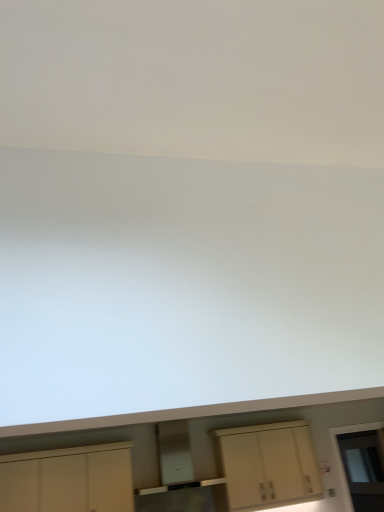
Question: Is white matte cabinet at lower left, which ranks as the 1th cabinetry in left-to-right order, closer to camera compared to transparent glass door at lower right?

Choices:
 (A) yes
 (B) no

Answer: (A)

Question: Is white matte cabinet at lower left, acting as the second cabinetry starting from the right, looking in the opposite direction of transparent glass door at lower right?

Choices:
 (A) no
 (B) yes

Answer: (A)

Question: Does white matte cabinet at lower left, acting as the second cabinetry starting from the right, have a lesser width compared to transparent glass door at lower right?

Choices:
 (A) no
 (B) yes

Answer: (A)

Question: Could you tell me if white matte cabinet at lower left, which ranks as the 1th cabinetry in left-to-right order, is facing transparent glass door at lower right?

Choices:
 (A) no
 (B) yes

Answer: (A)

Question: Is transparent glass door at lower right inside white matte cabinet at lower left, acting as the second cabinetry starting from the right?

Choices:
 (A) yes
 (B) no

Answer: (B)

Question: Can you confirm if white matte cabinet at lower left, which ranks as the 1th cabinetry in left-to-right order, is bigger than transparent glass door at lower right?

Choices:
 (A) yes
 (B) no

Answer: (A)

Question: Is transparent glass door at lower right bigger than matte cream cabinet at center, which is counted as the first cabinetry, starting from the right?

Choices:
 (A) yes
 (B) no

Answer: (B)

Question: Considering the relative sizes of transparent glass door at lower right and matte cream cabinet at center, which is counted as the first cabinetry, starting from the right, in the image provided, is transparent glass door at lower right thinner than matte cream cabinet at center, which is counted as the first cabinetry, starting from the right,?

Choices:
 (A) yes
 (B) no

Answer: (A)

Question: From the image's perspective, is transparent glass door at lower right located beneath matte cream cabinet at center, which is counted as the first cabinetry, starting from the right?

Choices:
 (A) no
 (B) yes

Answer: (B)

Question: Considering the relative sizes of transparent glass door at lower right and matte cream cabinet at center, which is counted as the first cabinetry, starting from the right, in the image provided, is transparent glass door at lower right taller than matte cream cabinet at center, which is counted as the first cabinetry, starting from the right,?

Choices:
 (A) yes
 (B) no

Answer: (A)

Question: Would you say transparent glass door at lower right is outside matte cream cabinet at center, the 2th cabinetry positioned from the left?

Choices:
 (A) yes
 (B) no

Answer: (A)

Question: From a real-world perspective, is transparent glass door at lower right on top of matte cream cabinet at center, which is counted as the first cabinetry, starting from the right?

Choices:
 (A) no
 (B) yes

Answer: (A)

Question: Does white matte cabinet at lower left, which ranks as the 1th cabinetry in left-to-right order, come behind matte cream cabinet at center, which is counted as the first cabinetry, starting from the right?

Choices:
 (A) yes
 (B) no

Answer: (B)